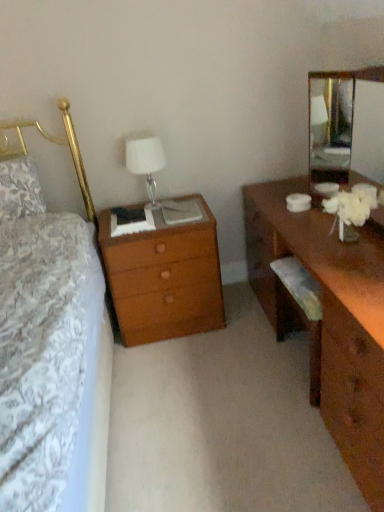
Question: Is point (329, 223) closer or farther from the camera than point (125, 265)?

Choices:
 (A) farther
 (B) closer

Answer: (B)

Question: In the image, is brown wooden desk at right on the left side or the right side of wooden nightstand at left?

Choices:
 (A) left
 (B) right

Answer: (B)

Question: Estimate the real-world distances between objects in this image. Which object is closer to the clear glass mirror at upper right?

Choices:
 (A) brown wooden desk at right
 (B) wooden nightstand at left
 (C) fluffy white pillow at left
 (D) white fabric lampshade at upper center

Answer: (A)

Question: Based on their relative distances, which object is farther from the white fabric lampshade at upper center?

Choices:
 (A) clear glass mirror at upper right
 (B) wooden nightstand at left
 (C) fluffy white pillow at left
 (D) brown wooden desk at right

Answer: (A)